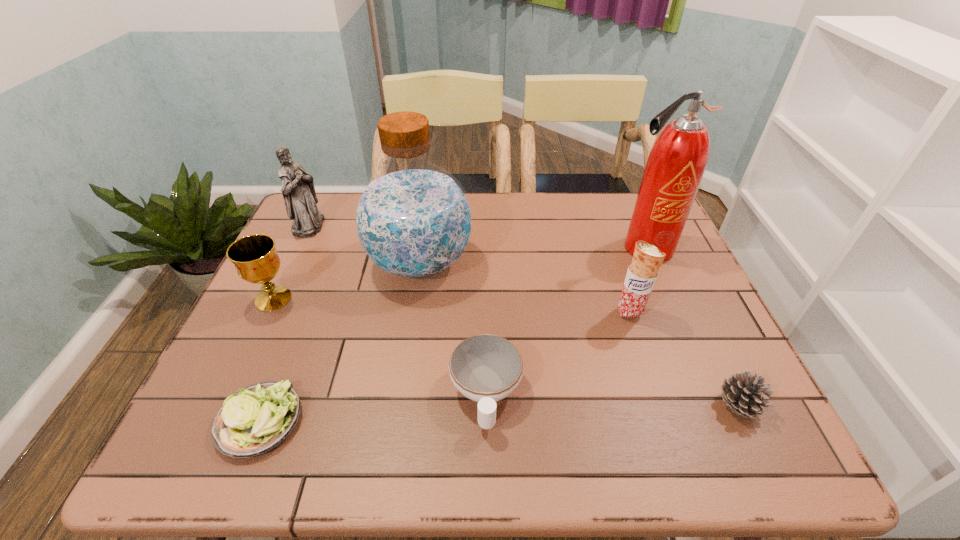
This screenshot has width=960, height=540. I want to click on vacant space located 0.050m on the front-facing side of the figurine, so click(340, 225).

What are the coordinates of `vacant space positioned on the front of the fourth tallest object` in the screenshot? It's located at (675, 447).

Image resolution: width=960 pixels, height=540 pixels. Identify the location of free space located on the right of the fifth tallest object. (348, 299).

At what (x,y) coordinates should I click in order to perform the action: click on free spot located 0.380m on the left of the pinecone. Please return your answer as a coordinate pair (x, y). Looking at the image, I should click on (531, 405).

The width and height of the screenshot is (960, 540). Find the location of `vacant space located 0.100m on the back of the lettuce`. vacant space located 0.100m on the back of the lettuce is located at coordinates (288, 348).

The image size is (960, 540). I want to click on fire extinguisher that is at the far edge, so click(676, 164).

The image size is (960, 540). Find the location of `water jug at the far edge`. water jug at the far edge is located at coordinates (413, 220).

You are a GUI agent. You are given a task and a screenshot of the screen. Output one action in this format:
    pyautogui.click(x=<x>, y=<y>)
    Task: Click on the figurine that is positioned at the far edge
    
    Given the screenshot: What is the action you would take?
    pyautogui.click(x=298, y=190)

Find the location of a particular element. The height and width of the screenshot is (540, 960). pinecone located in the near edge section of the desktop is located at coordinates (743, 392).

You are a GUI agent. You are given a task and a screenshot of the screen. Output one action in this format:
    pyautogui.click(x=<x>, y=<y>)
    Task: Click on the chinaware positioned at the near edge
    This screenshot has height=540, width=960.
    Given the screenshot: What is the action you would take?
    pyautogui.click(x=485, y=368)